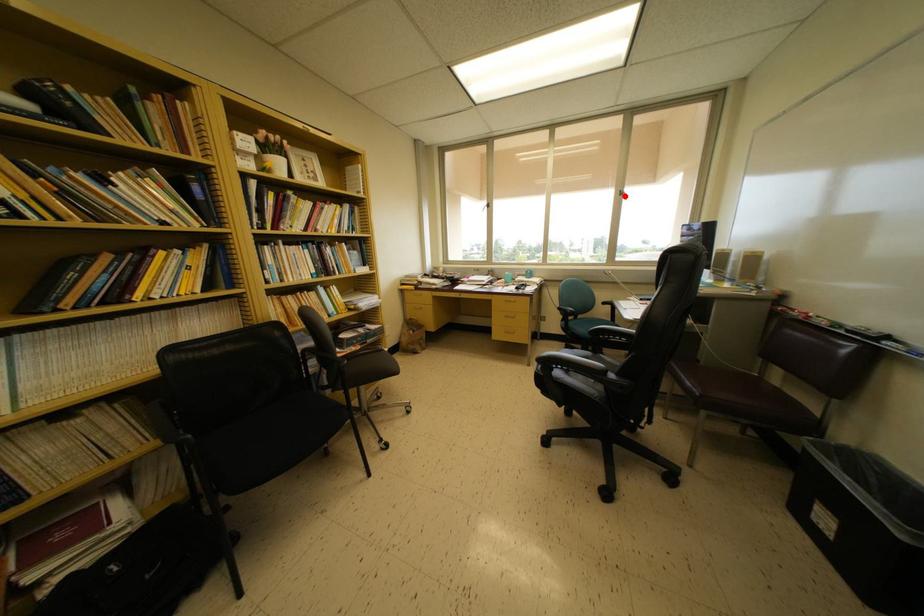
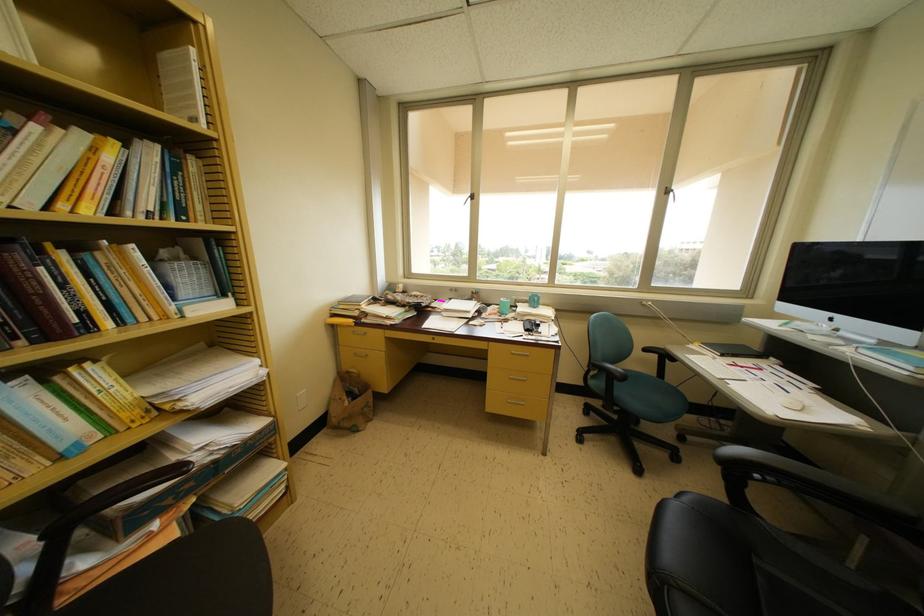
Question: I am providing you with two images of the same scene from different viewpoints. Image1 has a red point marked. In image2, the corresponding 3D location appears at what relative position? Reply with the corresponding letter.

Choices:
 (A) Closer
 (B) Farther

Answer: (B)